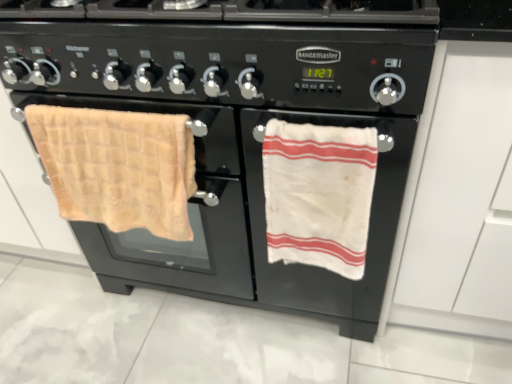
Question: Should I look upward or downward to see beige waffle weave towel at left, marked as the 1th beach towel in a left-to-right arrangement?

Choices:
 (A) down
 (B) up

Answer: (B)

Question: Is beige waffle weave towel at left, positioned as the 2th beach towel in right-to-left order, inside black matte gas stove at center?

Choices:
 (A) no
 (B) yes

Answer: (A)

Question: Is black matte gas stove at center aimed at beige waffle weave towel at left, positioned as the 2th beach towel in right-to-left order?

Choices:
 (A) no
 (B) yes

Answer: (A)

Question: Considering the relative sizes of black matte gas stove at center and beige waffle weave towel at left, marked as the 1th beach towel in a left-to-right arrangement, in the image provided, is black matte gas stove at center bigger than beige waffle weave towel at left, marked as the 1th beach towel in a left-to-right arrangement,?

Choices:
 (A) no
 (B) yes

Answer: (B)

Question: Is black matte gas stove at center in front of beige waffle weave towel at left, positioned as the 2th beach towel in right-to-left order?

Choices:
 (A) no
 (B) yes

Answer: (B)

Question: Can you confirm if black matte gas stove at center is smaller than beige waffle weave towel at left, positioned as the 2th beach towel in right-to-left order?

Choices:
 (A) yes
 (B) no

Answer: (B)

Question: From a real-world perspective, is black matte gas stove at center on beige waffle weave towel at left, marked as the 1th beach towel in a left-to-right arrangement?

Choices:
 (A) yes
 (B) no

Answer: (A)

Question: From a real-world perspective, is beige waffle weave towel at left, positioned as the 2th beach towel in right-to-left order, positioned over black matte gas stove at center based on gravity?

Choices:
 (A) no
 (B) yes

Answer: (A)

Question: From the image's perspective, is beige waffle weave towel at left, positioned as the 2th beach towel in right-to-left order, under black matte gas stove at center?

Choices:
 (A) yes
 (B) no

Answer: (A)

Question: Does beige waffle weave towel at left, marked as the 1th beach towel in a left-to-right arrangement, come in front of black matte gas stove at center?

Choices:
 (A) no
 (B) yes

Answer: (A)

Question: Can you confirm if beige waffle weave towel at left, marked as the 1th beach towel in a left-to-right arrangement, is smaller than black matte gas stove at center?

Choices:
 (A) no
 (B) yes

Answer: (B)

Question: Is black matte gas stove at center completely or partially inside beige waffle weave towel at left, positioned as the 2th beach towel in right-to-left order?

Choices:
 (A) yes
 (B) no

Answer: (B)

Question: Is beige waffle weave towel at left, positioned as the 2th beach towel in right-to-left order, aimed at black matte gas stove at center?

Choices:
 (A) no
 (B) yes

Answer: (A)

Question: From the image's perspective, is black matte gas stove at center on top of white matte drawer at right?

Choices:
 (A) no
 (B) yes

Answer: (B)